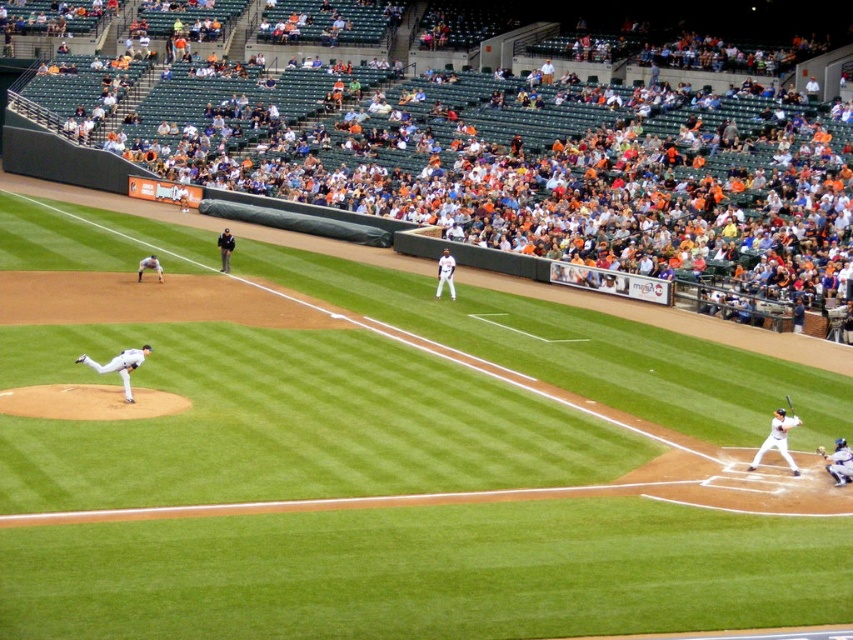
Question: Can you confirm if white uniform at center is smaller than black fabric referee at upper center?

Choices:
 (A) yes
 (B) no

Answer: (B)

Question: Does white matte bat at lower right have a smaller size compared to wooden bat at lower right?

Choices:
 (A) yes
 (B) no

Answer: (B)

Question: Which of the following is the closest to the observer?

Choices:
 (A) pyautogui.click(x=817, y=448)
 (B) pyautogui.click(x=222, y=259)

Answer: (A)

Question: Which object is closer to the camera taking this photo?

Choices:
 (A) orange fabric seats at upper center
 (B) white matte bat at lower right
 (C) wooden bat at lower right
 (D) white matte baseball player at center

Answer: (B)

Question: Is white matte baseball player at center further to camera compared to wooden bat at lower right?

Choices:
 (A) yes
 (B) no

Answer: (A)

Question: Estimate the real-world distances between objects in this image. Which object is farther from the white uniform at center?

Choices:
 (A) blue fabric catcher at lower right
 (B) white matte bat at lower right

Answer: (A)